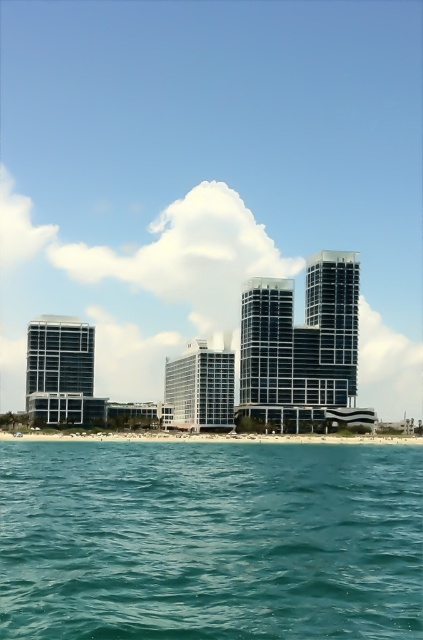
You are standing on the beach looking at the coastal urban landscape. There is a point marked at coordinates (209, 540). Which object from the scene does this point correspond to?

The point at coordinates (209, 540) corresponds to the teal glossy water at lower center.

You are standing at the base of the tallest building in the coastal urban landscape. You want to reach a specific point marked at coordinates point (142, 515). If your current distance from that point is 185.36 feet, can you estimate how far you need to walk to reach it?

The distance of point (142, 515) from viewer is 185.36 feet, so you need to walk approximately 185.36 feet to reach it.